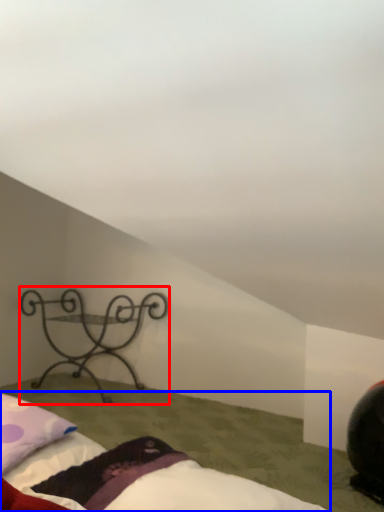
Question: Which object appears closest to the camera in this image, furniture (highlighted by a red box) or bed (highlighted by a blue box)?

Choices:
 (A) furniture
 (B) bed

Answer: (B)